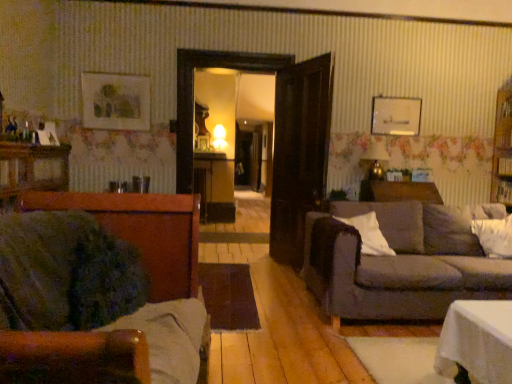
Question: From a real-world perspective, is white soft pillow at right, the second pillow in the right-to-left sequence, on top of velvet green couch at left, which is the first studio couch in front-to-back order?

Choices:
 (A) yes
 (B) no

Answer: (A)

Question: Would you consider white soft pillow at right, marked as the 1th pillow in a left-to-right arrangement, to be distant from velvet green couch at left, which is the first studio couch in front-to-back order?

Choices:
 (A) yes
 (B) no

Answer: (A)

Question: Considering the relative sizes of white soft pillow at right, the second pillow in the right-to-left sequence, and velvet green couch at left, which is the 1th studio couch in left-to-right order, in the image provided, is white soft pillow at right, the second pillow in the right-to-left sequence, thinner than velvet green couch at left, which is the 1th studio couch in left-to-right order,?

Choices:
 (A) no
 (B) yes

Answer: (B)

Question: Is white soft pillow at right, marked as the 1th pillow in a left-to-right arrangement, surrounding velvet green couch at left, which is the second studio couch from right to left?

Choices:
 (A) no
 (B) yes

Answer: (A)

Question: Is white soft pillow at right, marked as the 1th pillow in a left-to-right arrangement, looking in the opposite direction of velvet green couch at left, which is the first studio couch in front-to-back order?

Choices:
 (A) yes
 (B) no

Answer: (B)

Question: Considering the relative sizes of white soft pillow at right, the second pillow in the right-to-left sequence, and velvet green couch at left, which is the 1th studio couch in left-to-right order, in the image provided, is white soft pillow at right, the second pillow in the right-to-left sequence, shorter than velvet green couch at left, which is the 1th studio couch in left-to-right order,?

Choices:
 (A) yes
 (B) no

Answer: (A)

Question: From the image's perspective, is brown wooden dresser at left above white soft pillow at right, placed as the second pillow when sorted from left to right?

Choices:
 (A) no
 (B) yes

Answer: (B)

Question: Considering the relative positions of brown wooden dresser at left and white soft pillow at right, placed as the second pillow when sorted from left to right, in the image provided, is brown wooden dresser at left to the left of white soft pillow at right, placed as the second pillow when sorted from left to right, from the viewer's perspective?

Choices:
 (A) no
 (B) yes

Answer: (B)

Question: Is brown wooden dresser at left turned away from white soft pillow at right, placed as the second pillow when sorted from left to right?

Choices:
 (A) no
 (B) yes

Answer: (A)

Question: Is brown wooden dresser at left oriented towards white soft pillow at right, placed as the second pillow when sorted from left to right?

Choices:
 (A) yes
 (B) no

Answer: (A)

Question: Can you confirm if brown wooden dresser at left is smaller than white soft pillow at right, which appears as the first pillow when viewed from the right?

Choices:
 (A) yes
 (B) no

Answer: (B)

Question: Is brown wooden dresser at left positioned in front of white soft pillow at right, which appears as the first pillow when viewed from the right?

Choices:
 (A) yes
 (B) no

Answer: (A)

Question: Is white soft pillow at right, placed as the second pillow when sorted from left to right, aimed at white soft pillow at right, marked as the 1th pillow in a left-to-right arrangement?

Choices:
 (A) no
 (B) yes

Answer: (A)